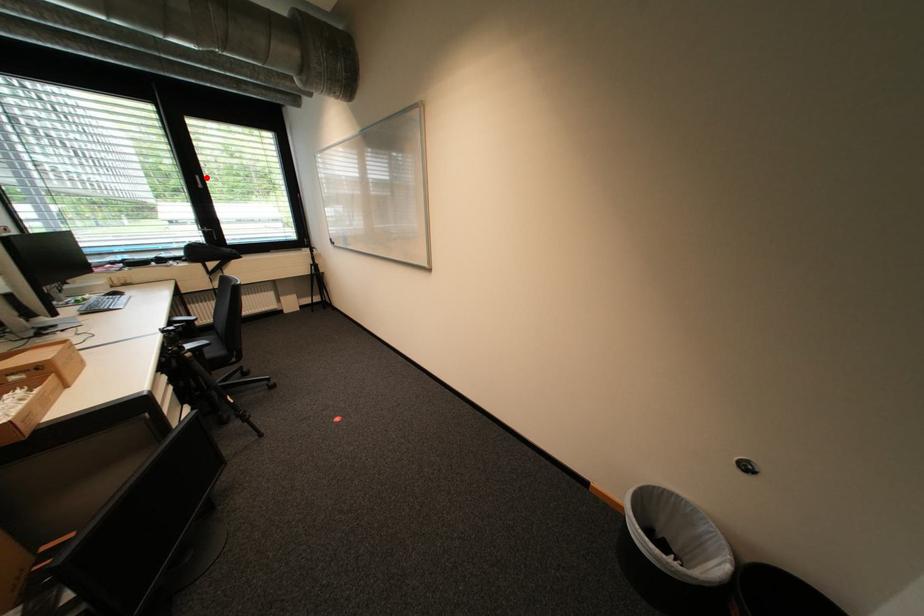
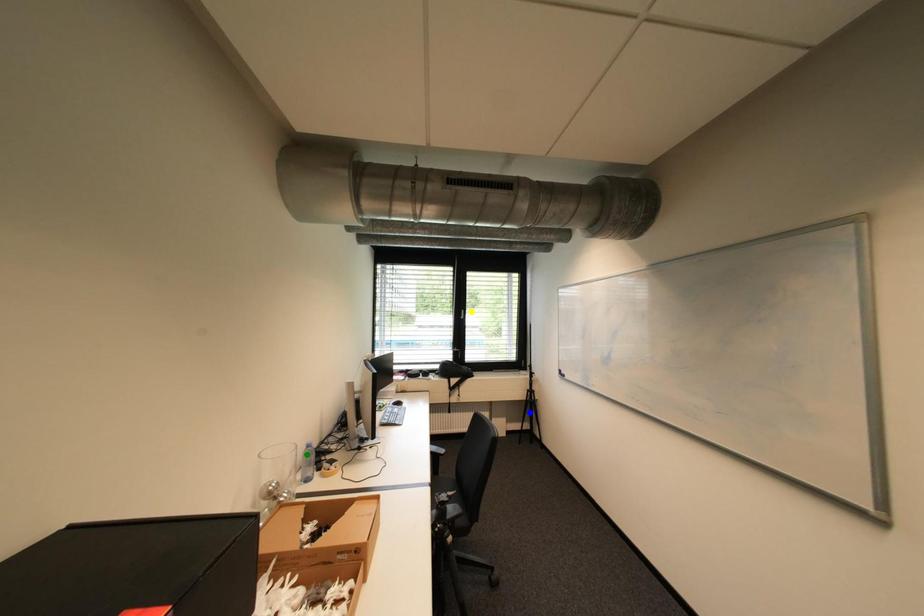
Question: I am providing you with two images of the same scene from different viewpoints. A red point is marked on the first image. You are given multiple points on the second image. Which spot in image 2 lines up with the point in image 1?

Choices:
 (A) blue point
 (B) green point
 (C) yellow point

Answer: (C)